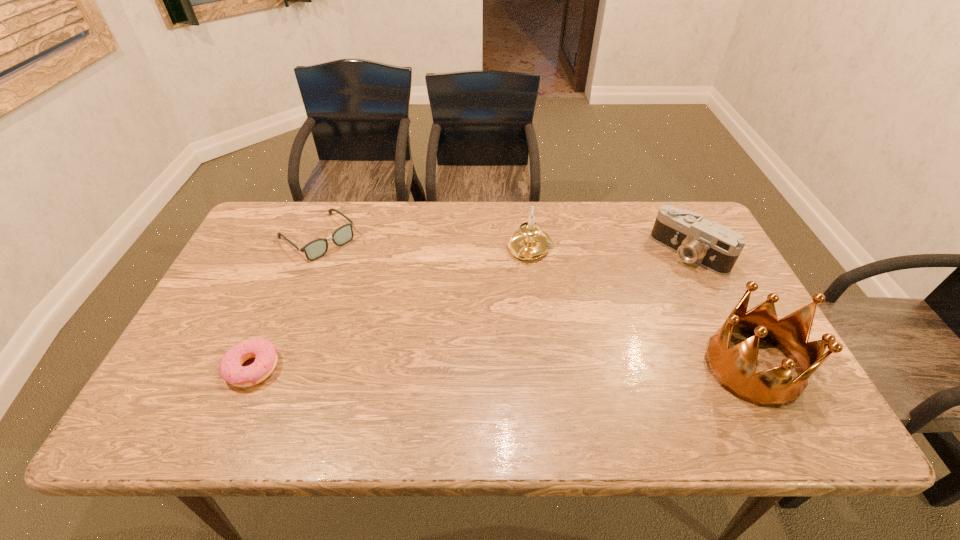
The width and height of the screenshot is (960, 540). Identify the location of doughnut located at the near edge. (231, 370).

Where is `crown that is at the near edge`? Image resolution: width=960 pixels, height=540 pixels. crown that is at the near edge is located at coordinates (734, 368).

You are a GUI agent. You are given a task and a screenshot of the screen. Output one action in this format:
    pyautogui.click(x=<x>, y=<y>)
    Task: Click on the doughnut located at the left edge
    
    Given the screenshot: What is the action you would take?
    pyautogui.click(x=231, y=370)

Identify the location of spectacles that is at the left edge. This screenshot has height=540, width=960. (315, 249).

Image resolution: width=960 pixels, height=540 pixels. I want to click on crown located at the right edge, so click(x=734, y=368).

Locate an element on the screen. Image resolution: width=960 pixels, height=540 pixels. camera positioned at the right edge is located at coordinates (715, 247).

The height and width of the screenshot is (540, 960). In order to click on object that is positioned at the far left corner in this screenshot , I will do `click(315, 249)`.

Identify the location of object situated at the near left corner. The height and width of the screenshot is (540, 960). (231, 370).

Locate an element on the screen. Image resolution: width=960 pixels, height=540 pixels. object located at the far right corner is located at coordinates (715, 247).

Where is `object that is positioned at the near right corner`? This screenshot has height=540, width=960. object that is positioned at the near right corner is located at coordinates (734, 368).